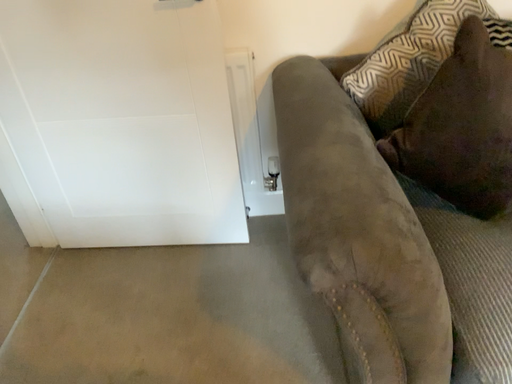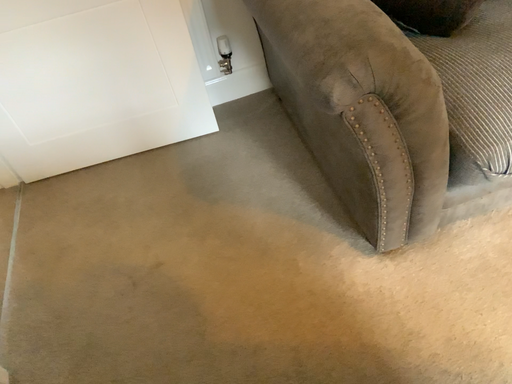
Question: Which way did the camera rotate in the video?

Choices:
 (A) rotated left
 (B) rotated right

Answer: (B)